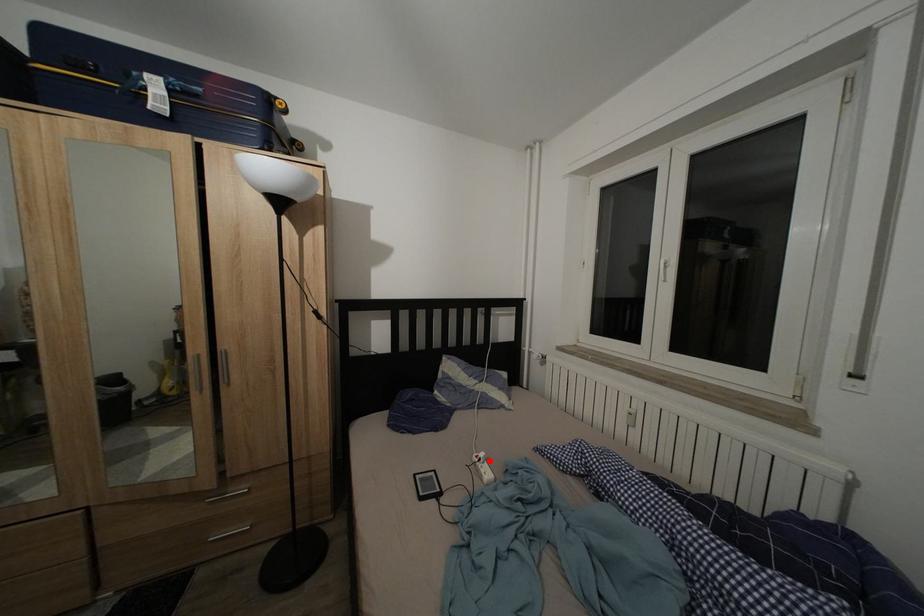
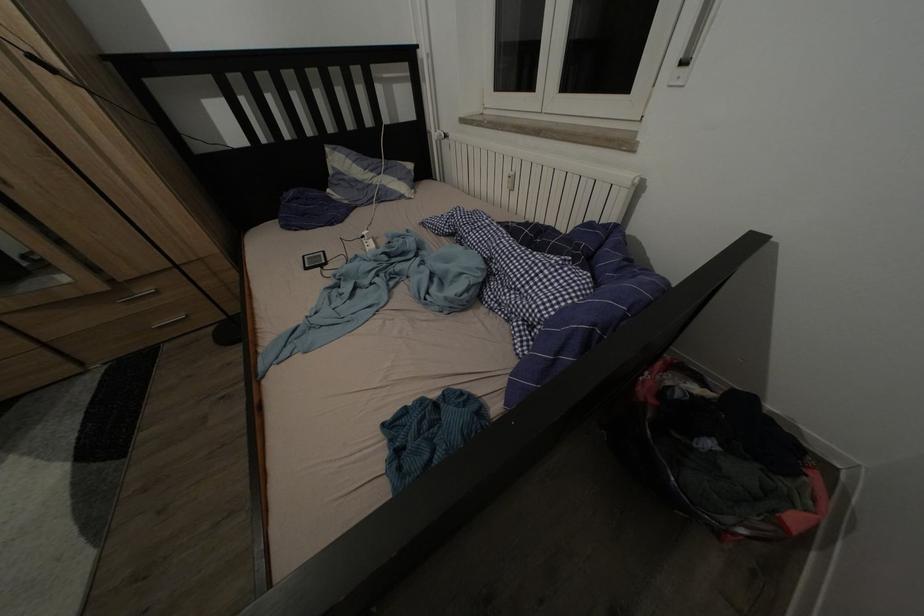
Question: I am providing you with two images of the same scene from different viewpoints. In image1, a red point is highlighted. Considering the same 3D point in image2, which of the following is correct?

Choices:
 (A) It is closer
 (B) It is farther

Answer: (B)